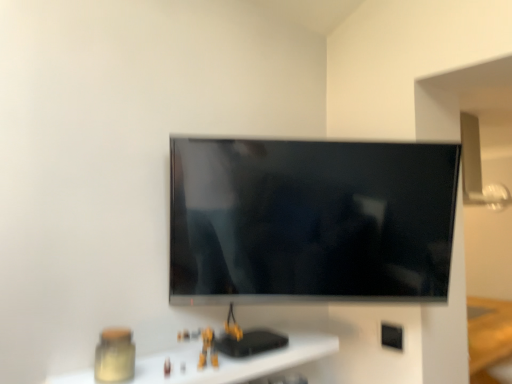
Question: Is black plastic electric outlet at lower right positioned behind matte glass jar at lower left?

Choices:
 (A) no
 (B) yes

Answer: (B)

Question: Could matte glass jar at lower left be considered to be inside black plastic electric outlet at lower right?

Choices:
 (A) yes
 (B) no

Answer: (B)

Question: From a real-world perspective, is black plastic electric outlet at lower right positioned under matte glass jar at lower left based on gravity?

Choices:
 (A) no
 (B) yes

Answer: (A)

Question: Is black plastic electric outlet at lower right touching matte glass jar at lower left?

Choices:
 (A) no
 (B) yes

Answer: (A)

Question: From the image's perspective, would you say black plastic electric outlet at lower right is shown under matte glass jar at lower left?

Choices:
 (A) yes
 (B) no

Answer: (A)

Question: From the image's perspective, relative to flat screen tv at center, is matte glass jar at lower left above or below?

Choices:
 (A) above
 (B) below

Answer: (B)

Question: Considering their positions, is matte glass jar at lower left located in front of or behind flat screen tv at center?

Choices:
 (A) front
 (B) behind

Answer: (A)

Question: In terms of width, does matte glass jar at lower left look wider or thinner when compared to flat screen tv at center?

Choices:
 (A) thin
 (B) wide

Answer: (B)

Question: From a real-world perspective, is matte glass jar at lower left positioned above or below flat screen tv at center?

Choices:
 (A) above
 (B) below

Answer: (B)

Question: From a real-world perspective, is black plastic electric outlet at lower right physically located above or below matte glass jar at lower left?

Choices:
 (A) below
 (B) above

Answer: (B)

Question: Is black plastic electric outlet at lower right situated inside matte glass jar at lower left or outside?

Choices:
 (A) outside
 (B) inside

Answer: (A)

Question: From the image's perspective, is black plastic electric outlet at lower right located above or below matte glass jar at lower left?

Choices:
 (A) above
 (B) below

Answer: (B)

Question: In terms of width, does black plastic electric outlet at lower right look wider or thinner when compared to matte glass jar at lower left?

Choices:
 (A) wide
 (B) thin

Answer: (B)

Question: From a real-world perspective, is black plastic electric outlet at lower right physically located above or below flat screen tv at center?

Choices:
 (A) below
 (B) above

Answer: (A)

Question: Looking at the image, does black plastic electric outlet at lower right seem bigger or smaller compared to flat screen tv at center?

Choices:
 (A) big
 (B) small

Answer: (B)